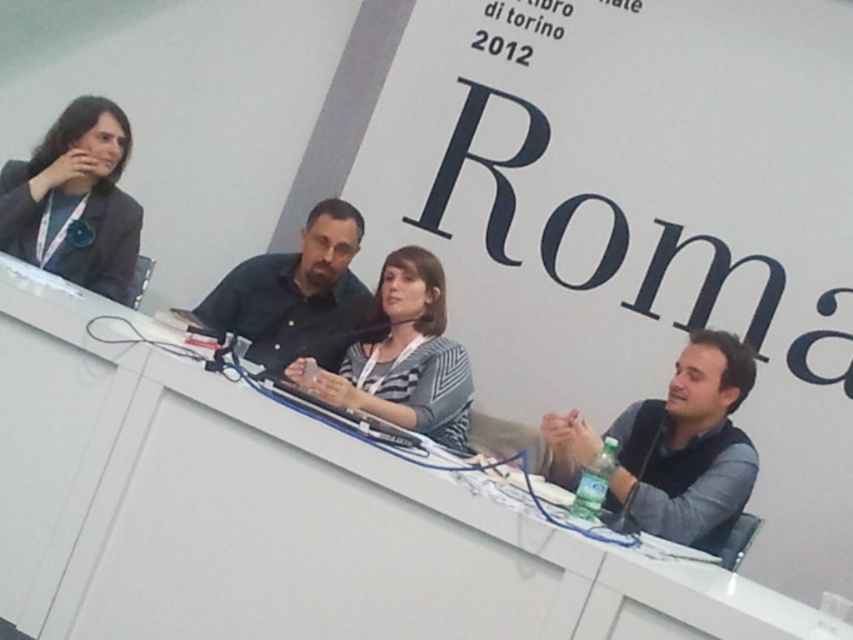
Between matte black jacket at upper left and black shirt at center, which one is positioned higher?

matte black jacket at upper left is above.

Can you confirm if matte black jacket at upper left is shorter than black shirt at center?

No, matte black jacket at upper left is not shorter than black shirt at center.

Does point (74, 141) come in front of point (345, 248)?

That is True.

Where is `matte black jacket at upper left`? This screenshot has width=853, height=640. matte black jacket at upper left is located at coordinates (74, 200).

Which is behind, point (111, 285) or point (370, 381)?

The point (111, 285) is more distant.

Which is above, matte black jacket at upper left or striped fabric shirt at center?

matte black jacket at upper left is above.

Identify the location of matte black jacket at upper left. (74, 200).

At what (x,y) coordinates should I click in order to perform the action: click on matte black jacket at upper left. Please return your answer as a coordinate pair (x, y). This screenshot has width=853, height=640. Looking at the image, I should click on (74, 200).

Is point (207, 449) farther from camera compared to point (723, 506)?

No, (207, 449) is closer to viewer.

Which is in front, point (585, 624) or point (648, 493)?

Point (585, 624) is more forward.

I want to click on white plastic table at center, so click(277, 515).